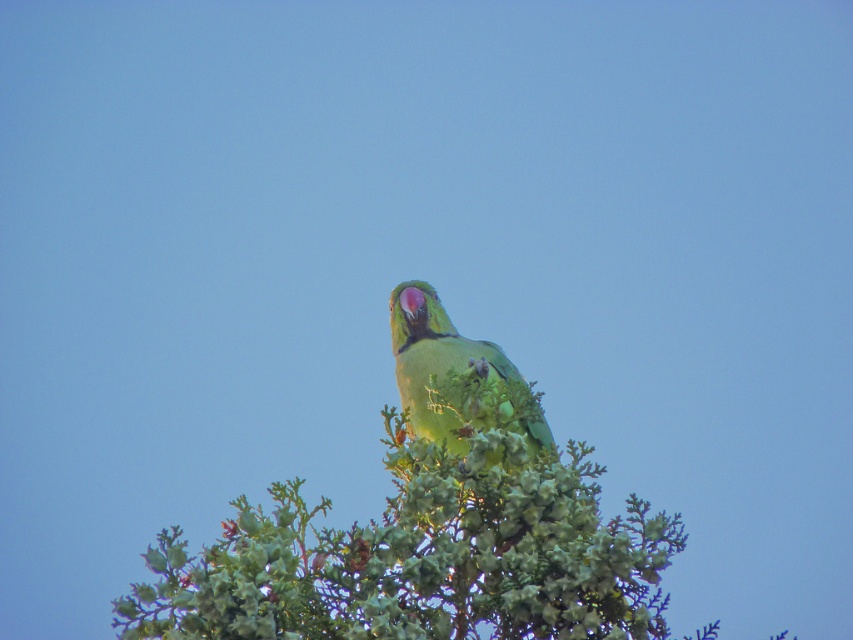
Question: Which point appears closest to the camera in this image?

Choices:
 (A) (476, 376)
 (B) (294, 493)

Answer: (B)

Question: Can you confirm if green leafy tree at center is positioned to the left of green matte parrot at center?

Choices:
 (A) no
 (B) yes

Answer: (B)

Question: Does green leafy tree at center appear under green matte parrot at center?

Choices:
 (A) yes
 (B) no

Answer: (A)

Question: Which point is closer to the camera taking this photo?

Choices:
 (A) [378, 636]
 (B) [538, 436]

Answer: (A)

Question: Is green leafy tree at center in front of green matte parrot at center?

Choices:
 (A) no
 (B) yes

Answer: (B)